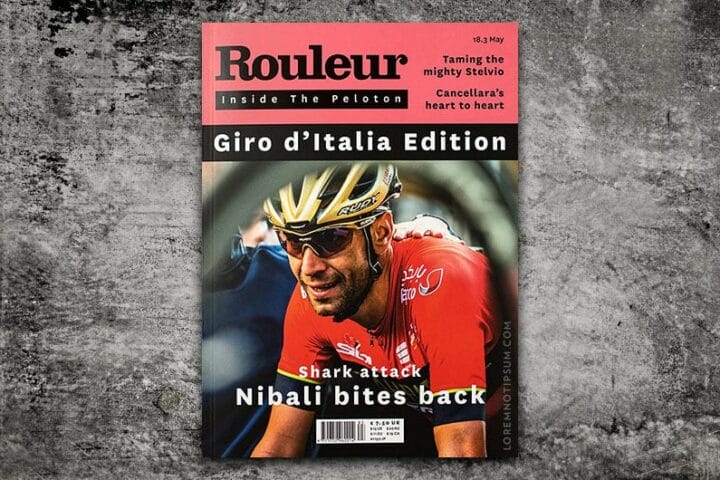
The image size is (720, 480). What are the coordinates of `table top` in the screenshot? It's located at (577, 258).